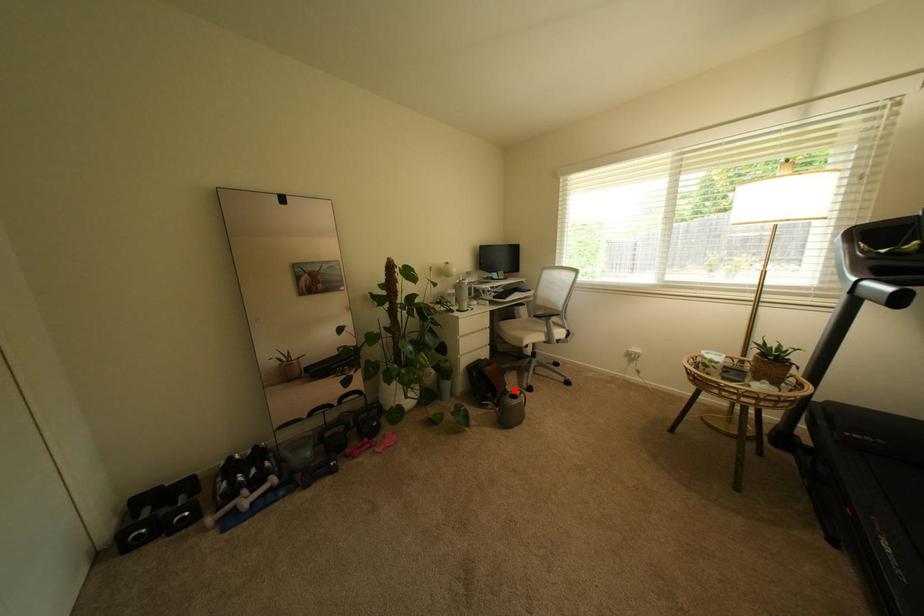
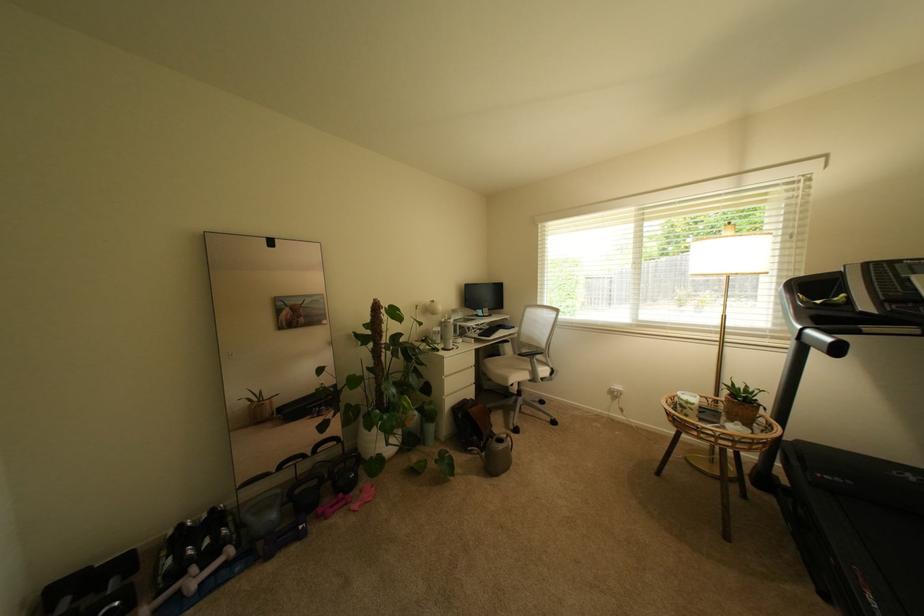
Question: I am providing you with two images of the same scene from different viewpoints. Image1 has a red point marked. In image2, the corresponding 3D location appears at what relative position? Reply with the corresponding letter.

Choices:
 (A) Closer
 (B) Farther

Answer: (B)